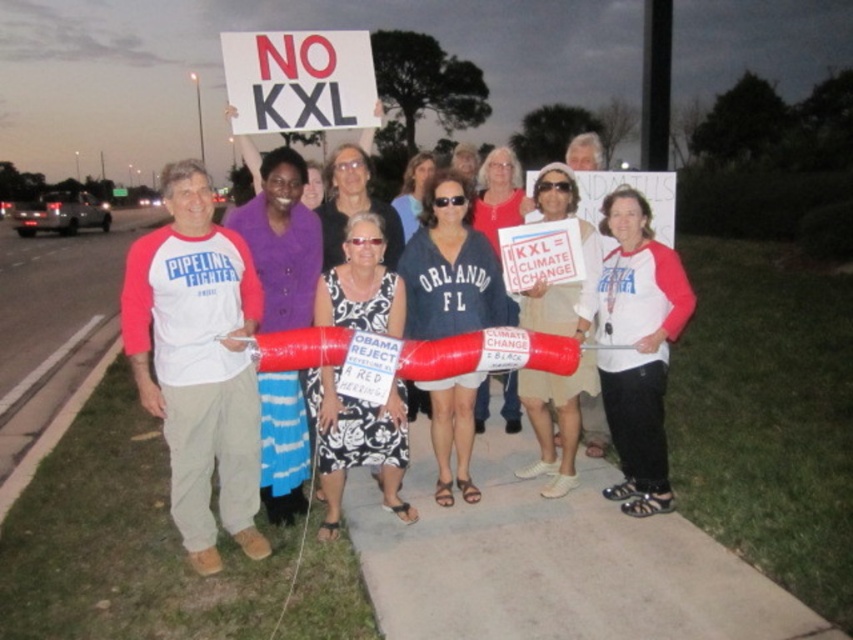
Who is shorter, black printed dress at center or purple fabric dress at center?

black printed dress at center is shorter.

Can you confirm if black printed dress at center is positioned to the right of purple fabric dress at center?

Correct, you'll find black printed dress at center to the right of purple fabric dress at center.

Does point (341, 310) come behind point (265, 202)?

No, (341, 310) is closer to viewer.

I want to click on black printed dress at center, so click(357, 444).

This screenshot has height=640, width=853. I want to click on white matte t-shirt at center, so click(x=637, y=348).

Between point (637, 397) and point (273, 304), which one is positioned behind?

Positioned behind is point (273, 304).

Who is more distant from viewer, (664, 435) or (260, 384)?

The point (664, 435) is behind.

Locate an element on the screen. Image resolution: width=853 pixels, height=640 pixels. white matte t-shirt at center is located at coordinates (637, 348).

Which of these two, purple fabric dress at center or matte white shirt at center, stands shorter?

With less height is purple fabric dress at center.

Which of these two, purple fabric dress at center or matte white shirt at center, stands taller?

matte white shirt at center

This screenshot has height=640, width=853. Describe the element at coordinates (281, 241) in the screenshot. I see `purple fabric dress at center` at that location.

Locate an element on the screen. The width and height of the screenshot is (853, 640). purple fabric dress at center is located at coordinates (281, 241).